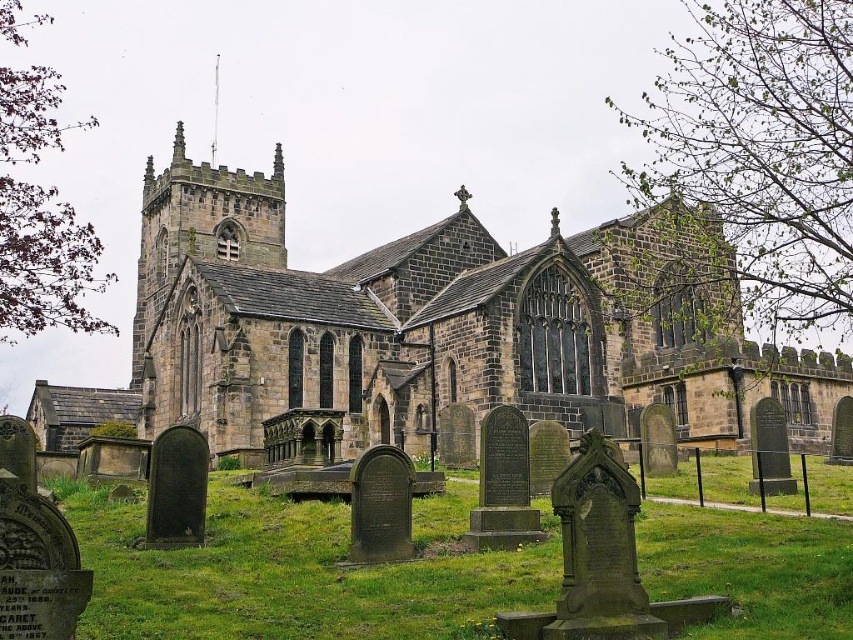
You are standing in the cemetery and want to take a photo of the stone church at center. Since the green grass at lower center is in the way, will you need to move closer or farther away to get the entire church in the frame?

The stone church at center is larger in size than green grass at lower center. To capture the entire church in the frame, you would need to move closer to reduce the size of the church relative to the grass, but since the church is already larger, moving farther away might help fit it better. However, since the grass is at lower center, adjusting your angle or zoom might be more effective than moving distance.

You are standing in front of the historic stone church and want to locate two specific points marked in the image. The first point is at coordinates point (183, 346) and the second is at point (796, 573). Which of these two points is closer to you?

Point (183, 346) is closer to you because it is further to the viewer than point (796, 573).

You are standing at the entrance of the cemetery and want to find the stone church at center. Based on the coordinates provided, in which direction should you walk to reach the church?

The stone church at center is located at coordinates point (416,330), so you should walk towards the center of the cemetery to reach it.